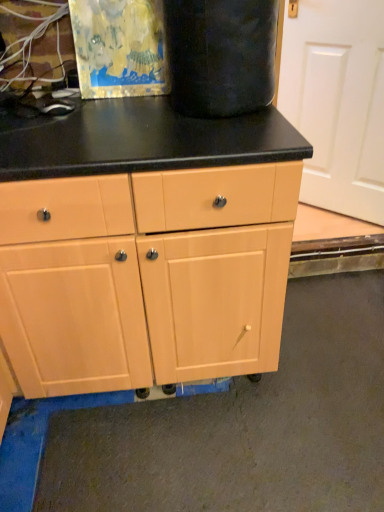
Question: Is matte wood cabinet at center wider or thinner than white matte screen door at upper right?

Choices:
 (A) wide
 (B) thin

Answer: (A)

Question: From a real-world perspective, is matte wood cabinet at center physically located above or below white matte screen door at upper right?

Choices:
 (A) below
 (B) above

Answer: (A)

Question: Do you think matte wood cabinet at center is within white matte screen door at upper right, or outside of it?

Choices:
 (A) inside
 (B) outside

Answer: (B)

Question: Visually, is white matte screen door at upper right positioned to the left or to the right of matte wood cabinet at center?

Choices:
 (A) right
 (B) left

Answer: (A)

Question: From a real-world perspective, is white matte screen door at upper right above or below matte wood cabinet at center?

Choices:
 (A) below
 (B) above

Answer: (B)

Question: Looking at their shapes, would you say white matte screen door at upper right is wider or thinner than matte wood cabinet at center?

Choices:
 (A) thin
 (B) wide

Answer: (A)

Question: From the image's perspective, relative to matte wood cabinet at center, is white matte screen door at upper right above or below?

Choices:
 (A) below
 (B) above

Answer: (B)